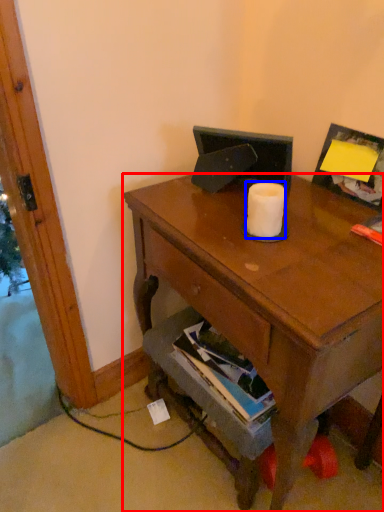
Question: Which object appears closest to the camera in this image, desk (highlighted by a red box) or toilet paper (highlighted by a blue box)?

Choices:
 (A) desk
 (B) toilet paper

Answer: (A)